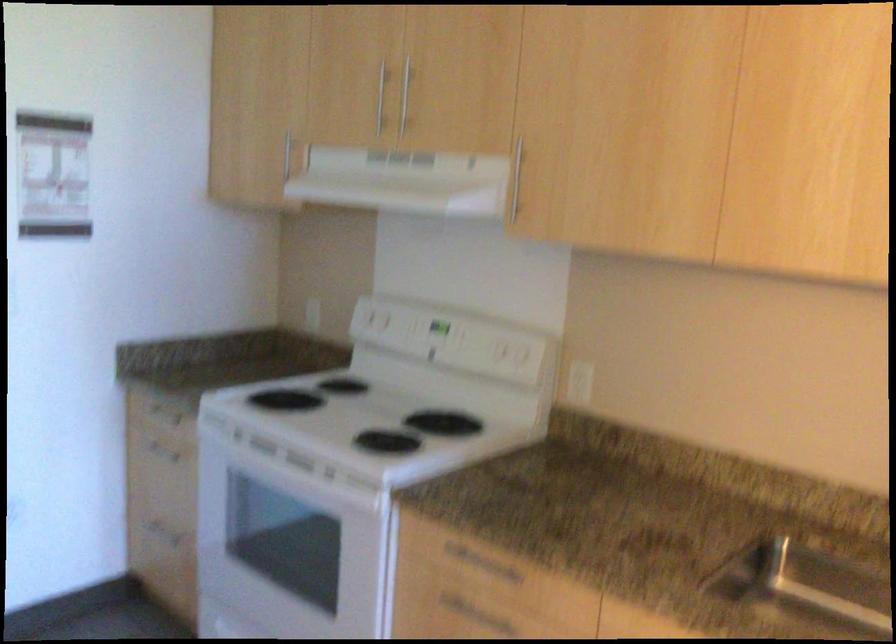
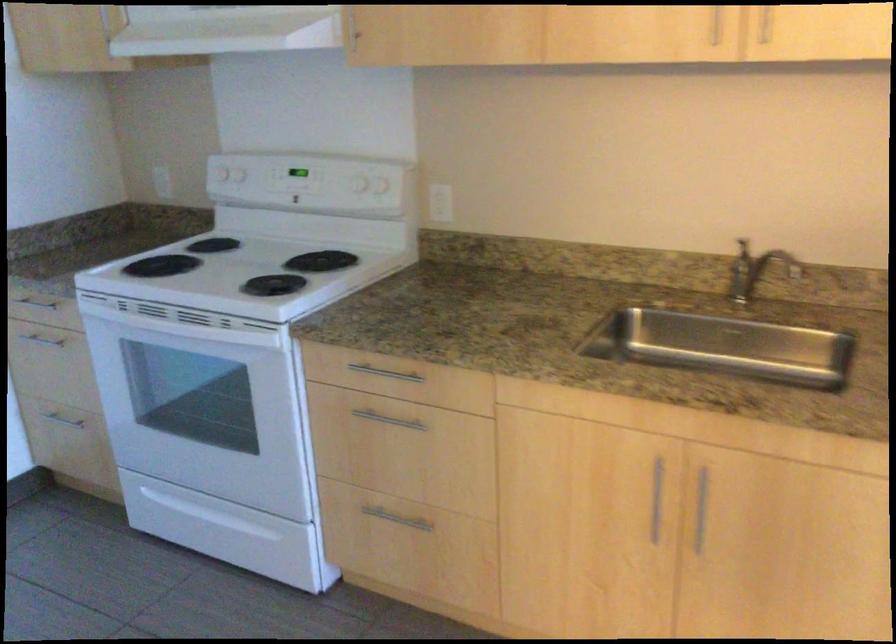
In a continuous first-person perspective shot, in which direction is the camera moving?

The cameraman moved toward left, backward.